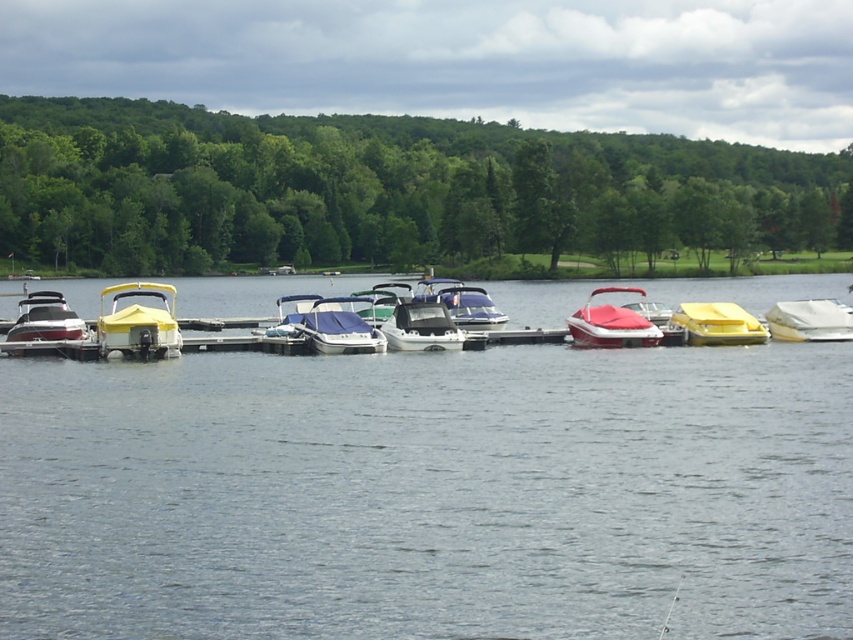
Question: Which point is farther to the camera?

Choices:
 (A) white matte boat at right
 (B) white glossy boat at center

Answer: (A)

Question: Which point is closer to the camera taking this photo?

Choices:
 (A) (334, 314)
 (B) (155, 355)
 (C) (498, 212)

Answer: (B)

Question: Among these objects, which one is nearest to the camera?

Choices:
 (A) clear water at center
 (B) white glossy boat at center

Answer: (A)

Question: Is red matte boat at center to the right of yellow matte boat at center from the viewer's perspective?

Choices:
 (A) yes
 (B) no

Answer: (B)

Question: Does green leafy trees at upper left appear on the left side of white matte boat at right?

Choices:
 (A) no
 (B) yes

Answer: (B)

Question: In this image, where is shiny white boat at left located relative to white matte boat at right?

Choices:
 (A) below
 (B) above

Answer: (A)